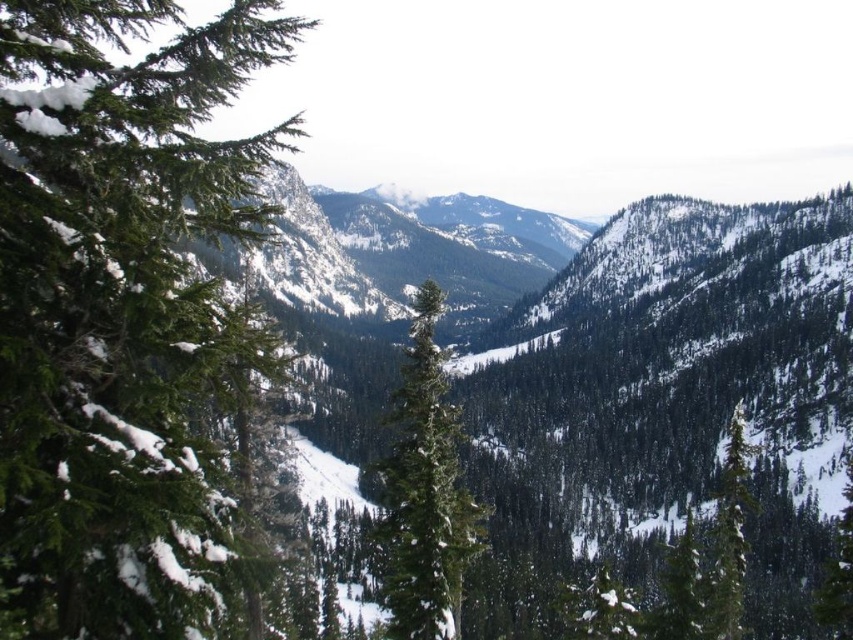
Describe the element at coordinates (424, 493) in the screenshot. I see `green textured tree at center` at that location.

Is point (463, 548) closer to viewer compared to point (740, 540)?

Yes, it is.

Image resolution: width=853 pixels, height=640 pixels. Describe the element at coordinates (424, 493) in the screenshot. I see `green textured tree at center` at that location.

Identify the location of green textured tree at center. (424, 493).

Measure the distance from green matte evergreen tree at left to green textured tree at center.

They are 72.23 feet apart.

Is point (97, 195) positioned after point (447, 557)?

No, (97, 195) is in front of (447, 557).

The image size is (853, 640). Find the location of `green matte evergreen tree at left`. green matte evergreen tree at left is located at coordinates (115, 308).

Can you confirm if green matte evergreen tree at left is positioned below green matte tree at right?

No.

Between green matte evergreen tree at left and green matte tree at right, which one has less height?

green matte tree at right

Locate an element on the screen. green matte evergreen tree at left is located at coordinates (115, 308).